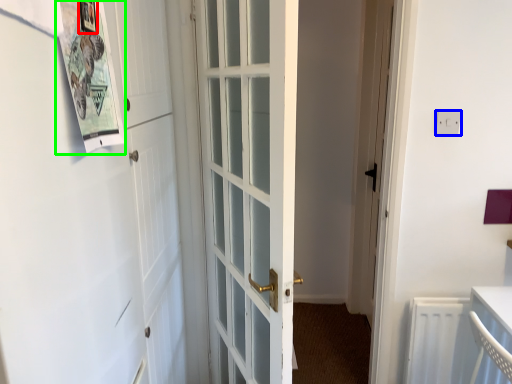
Question: Considering the real-world distances, which object is farthest from picture frame (highlighted by a red box)? electric outlet (highlighted by a blue box) or bulletin board (highlighted by a green box)?

Choices:
 (A) electric outlet
 (B) bulletin board

Answer: (A)